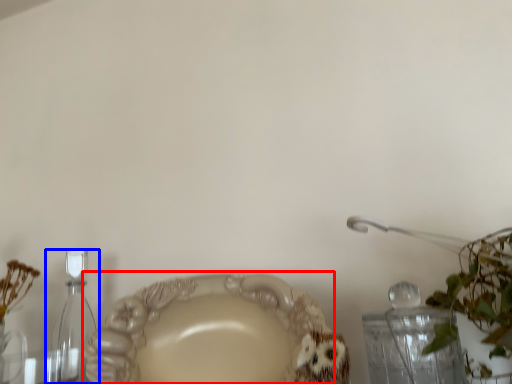
Question: Which object appears farthest to the camera in this image, plate (highlighted by a red box) or bottle (highlighted by a blue box)?

Choices:
 (A) plate
 (B) bottle

Answer: (B)